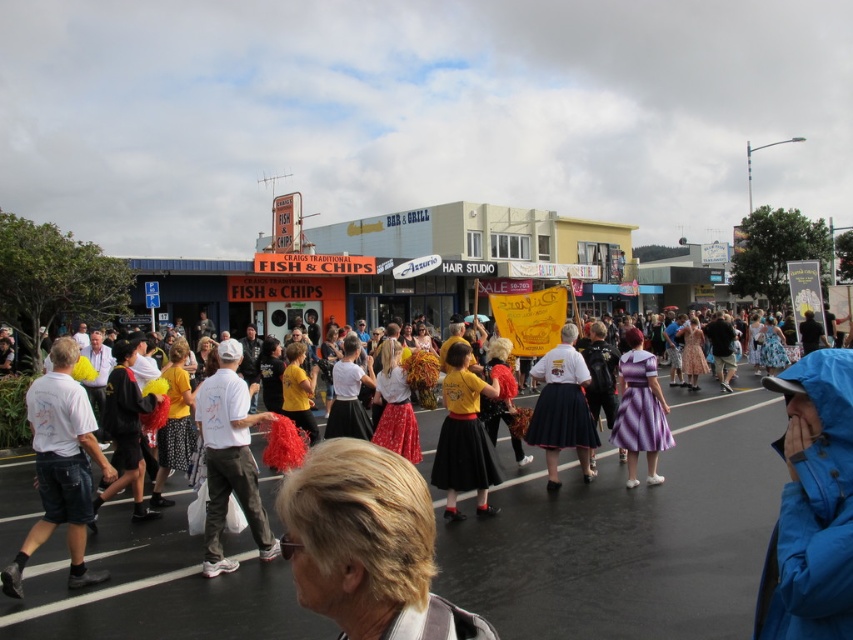
You are a photographer at the event and want to capture a clear shot of the white cotton shirt at center without the blonde hair at center blocking it. How should you adjust your camera angle?

To capture the white cotton shirt at center without the blonde hair at center blocking it, you should angle your camera downward since the blonde hair at center is positioned over the white cotton shirt at center.

You are a photographer at the event and want to capture both the blonde hair at center and the white cotton shirt at center in a single photo. Which object should you position closer to the left side of the camera frame to ensure both are visible?

To ensure both the blonde hair at center and the white cotton shirt at center are visible, position the white cotton shirt at center closer to the left side of the camera frame since the blonde hair at center is already on the right side of it.